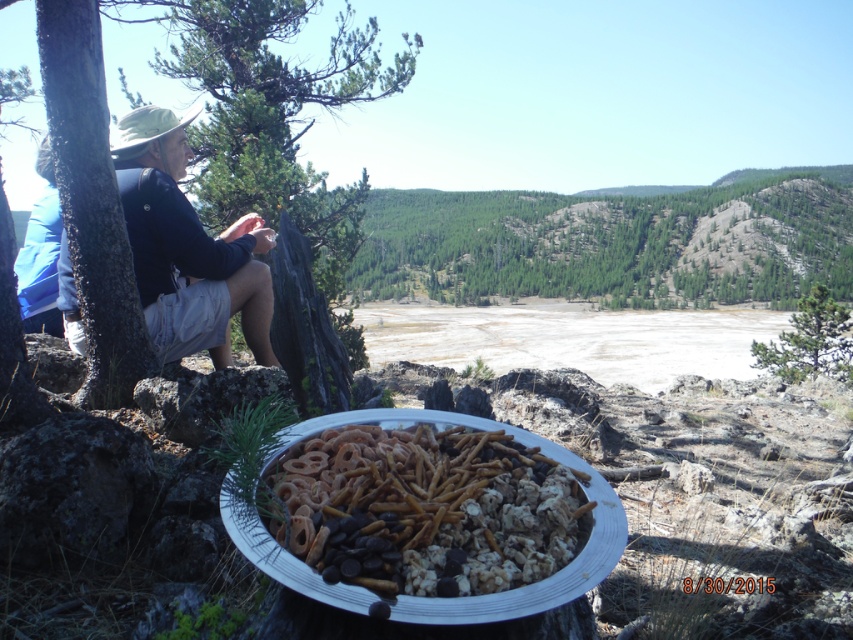
Question: Which is farther from the green textured pine tree at center?

Choices:
 (A) golden crunchy pretzels at center
 (B) green leafy tree at left

Answer: (B)

Question: Does green leafy tree at center have a larger size compared to golden crunchy pretzels at center?

Choices:
 (A) no
 (B) yes

Answer: (B)

Question: Is golden crunchy pretzels at center behind green leafy tree at left?

Choices:
 (A) yes
 (B) no

Answer: (B)

Question: Which object is closer to the camera taking this photo?

Choices:
 (A) green leafy tree at center
 (B) golden crunchy pretzels at center

Answer: (B)

Question: Among these objects, which one is farthest from the camera?

Choices:
 (A) green leafy tree at center
 (B) golden crunchy pretzels at center
 (C) green textured pine tree at center

Answer: (C)

Question: Does green leafy tree at center appear on the left side of golden crunchy pretzels at center?

Choices:
 (A) yes
 (B) no

Answer: (B)